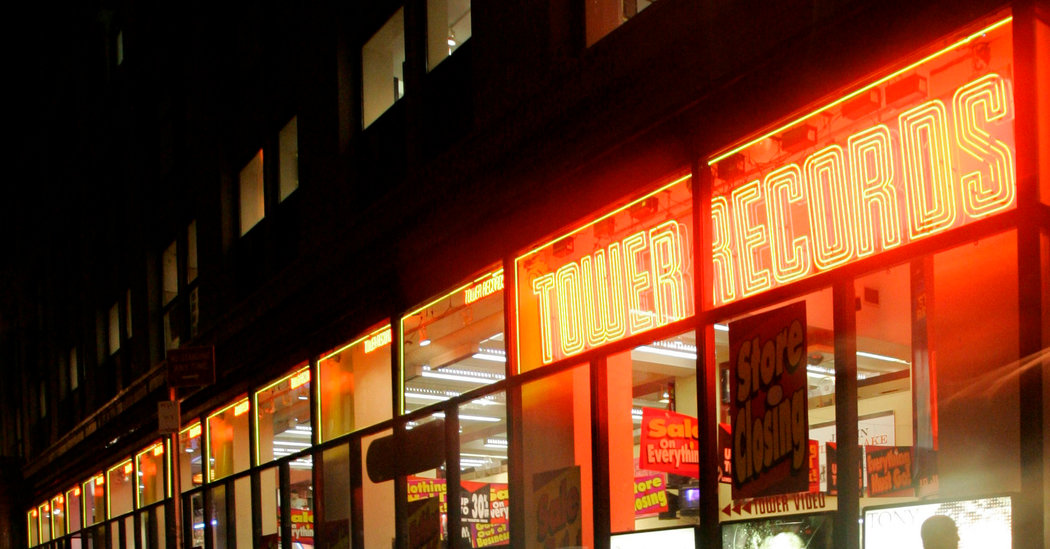
In order to click on white posters in window lower right corner in this screenshot , I will do `click(916, 522)`, `click(677, 537)`.